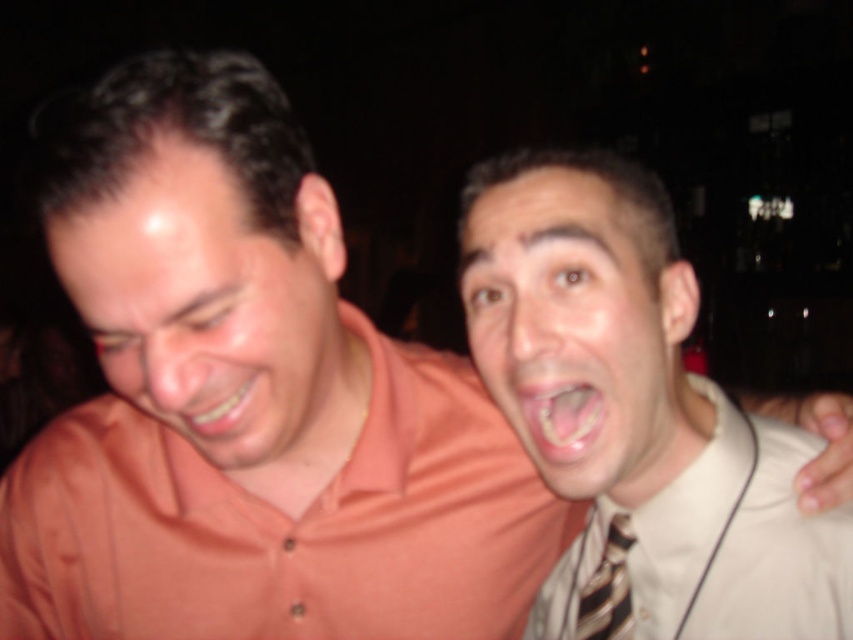
You are a photographer holding a camera and want to take a photo of the scene. The camera is currently positioned at point [646,593]. You need to adjust your position so that you are exactly 30 inches away from the camera to achieve the desired framing. In which direction should you move relative to the current position?

Since the point [646,593] and the camera are currently 27.19 inches apart, you need to move away from the camera by approximately 2.81 inches to reach the desired 30 inches distance.

You are designing a poster and need to place two elements based on their sizes. You have a matte orange shirt at left and a pink glossy tongue at center. Which object should you make larger in your design to maintain accuracy?

The matte orange shirt at left should be made larger in the design because its width is greater than that of the pink glossy tongue at center.

You are a photographer trying to capture a candid shot of the pink glossy tongue at center without including the matte orange shirt at left in the frame. Based on their positions, is this possible?

The matte orange shirt at left is in front of the pink glossy tongue at center, so the photographer cannot capture the pink glossy tongue at center without including the matte orange shirt at left in the frame.